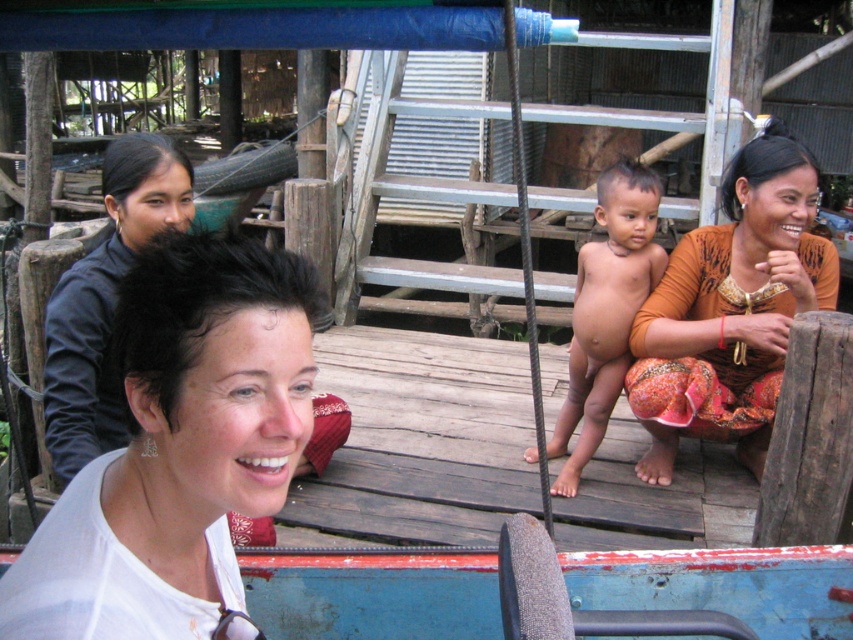
Measure the distance between white matte shirt at upper left and camera.

A distance of 36.92 inches exists between white matte shirt at upper left and camera.

Where is `white matte shirt at upper left`? The width and height of the screenshot is (853, 640). white matte shirt at upper left is located at coordinates (178, 449).

Is orange fabric at right further to the viewer compared to smooth skin baby at center?

No, orange fabric at right is in front of smooth skin baby at center.

What do you see at coordinates (730, 308) in the screenshot? The image size is (853, 640). I see `orange fabric at right` at bounding box center [730, 308].

This screenshot has height=640, width=853. What do you see at coordinates (730, 308) in the screenshot?
I see `orange fabric at right` at bounding box center [730, 308].

The height and width of the screenshot is (640, 853). I want to click on orange fabric at right, so click(730, 308).

Which is behind, point (141, 518) or point (663, 332)?

The point (663, 332) is behind.

Is white matte shirt at upper left below orange fabric at right?

Yes, white matte shirt at upper left is below orange fabric at right.

Image resolution: width=853 pixels, height=640 pixels. I want to click on white matte shirt at upper left, so click(x=178, y=449).